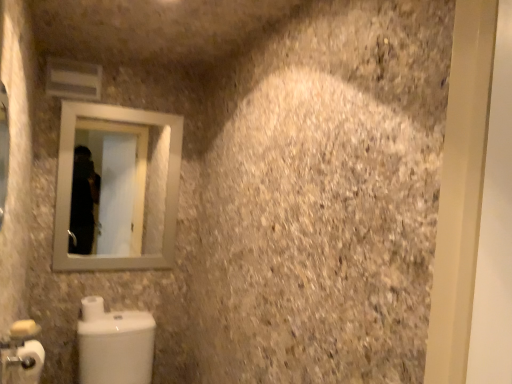
Question: Does white matte toilet paper at lower left, which is the second toilet paper in back-to-front order, lie behind white glossy toilet at lower left?

Choices:
 (A) yes
 (B) no

Answer: (B)

Question: From a real-world perspective, is white matte toilet paper at lower left, which is the second toilet paper in back-to-front order, positioned under white glossy toilet at lower left based on gravity?

Choices:
 (A) no
 (B) yes

Answer: (A)

Question: Does white matte toilet paper at lower left, which is the second toilet paper in back-to-front order, have a greater width compared to white glossy toilet at lower left?

Choices:
 (A) yes
 (B) no

Answer: (B)

Question: From a real-world perspective, is white matte toilet paper at lower left, which is the second toilet paper in back-to-front order, physically above white glossy toilet at lower left?

Choices:
 (A) yes
 (B) no

Answer: (A)

Question: Is white matte toilet paper at lower left, which is the second toilet paper in back-to-front order, taller than white glossy toilet at lower left?

Choices:
 (A) no
 (B) yes

Answer: (A)

Question: Can you confirm if white matte toilet paper at lower left, which is the second toilet paper in back-to-front order, is shorter than white glossy toilet at lower left?

Choices:
 (A) yes
 (B) no

Answer: (A)

Question: Is silver metallic mirror at upper left located outside white glossy toilet at lower left?

Choices:
 (A) yes
 (B) no

Answer: (A)

Question: From a real-world perspective, is silver metallic mirror at upper left on top of white glossy toilet at lower left?

Choices:
 (A) yes
 (B) no

Answer: (A)

Question: From a real-world perspective, is silver metallic mirror at upper left below white glossy toilet at lower left?

Choices:
 (A) no
 (B) yes

Answer: (A)

Question: Is silver metallic mirror at upper left with white glossy toilet at lower left?

Choices:
 (A) no
 (B) yes

Answer: (A)

Question: Is silver metallic mirror at upper left oriented away from white glossy toilet at lower left?

Choices:
 (A) yes
 (B) no

Answer: (B)

Question: Considering the relative sizes of silver metallic mirror at upper left and white glossy toilet at lower left in the image provided, is silver metallic mirror at upper left taller than white glossy toilet at lower left?

Choices:
 (A) no
 (B) yes

Answer: (B)

Question: Is white matte toilet paper at lower left, which is the second toilet paper in back-to-front order, inside white matte toilet paper at lower left, acting as the 1th toilet paper starting from the back?

Choices:
 (A) no
 (B) yes

Answer: (A)